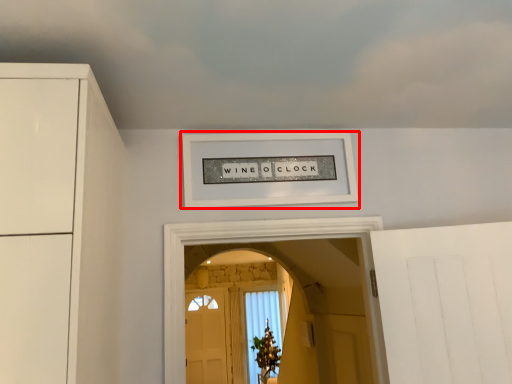
Question: Observing the image, what is the correct spatial positioning of picture frame (annotated by the red box) in reference to cloud?

Choices:
 (A) right
 (B) left

Answer: (B)